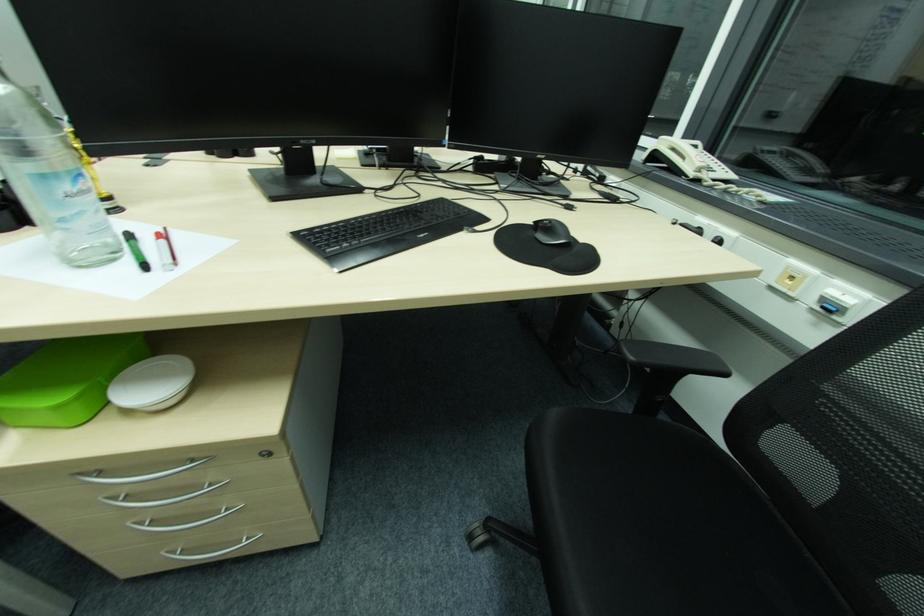
Identify the location of white wall switch. (791, 280).